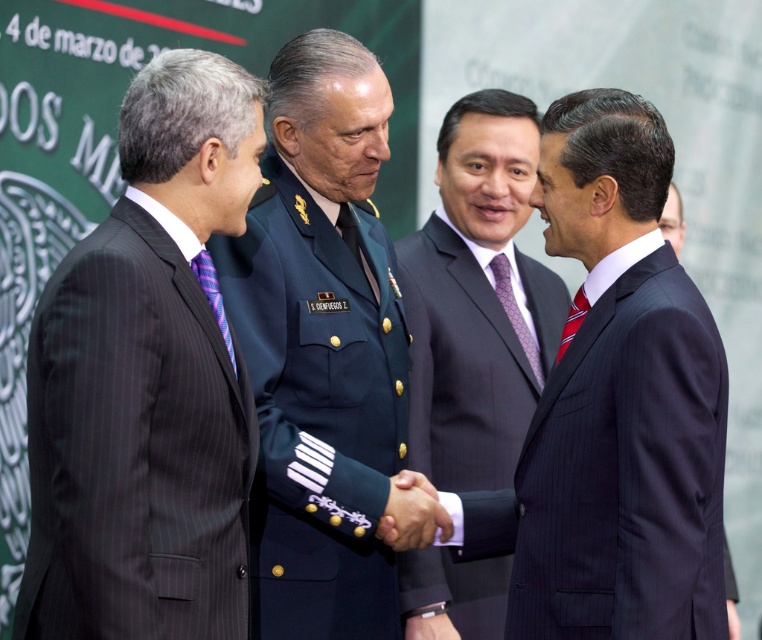
Is purple textured tie at center above purple striped tie at left?

No.

Between purple textured tie at center and purple striped tie at left, which one appears on the left side from the viewer's perspective?

purple striped tie at left

Does point (516, 321) lie in front of point (202, 273)?

That is False.

In order to click on purple textured tie at center in this screenshot , I will do `click(514, 312)`.

From the picture: Which is more to the left, dark blue suit at center or black silk hand at center?

From the viewer's perspective, black silk hand at center appears more on the left side.

Which is behind, point (501, 444) or point (396, 504)?

The point (501, 444) is more distant.

Is point (437, 140) closer to camera compared to point (399, 506)?

No, (437, 140) is behind (399, 506).

I want to click on dark blue suit at center, so click(476, 300).

Which is above, green military uniform at center or purple textured tie at center?

purple textured tie at center is higher up.

Based on the photo, between green military uniform at center and purple textured tie at center, which one has less height?

purple textured tie at center is shorter.

Where is `green military uniform at center`? green military uniform at center is located at coordinates (322, 348).